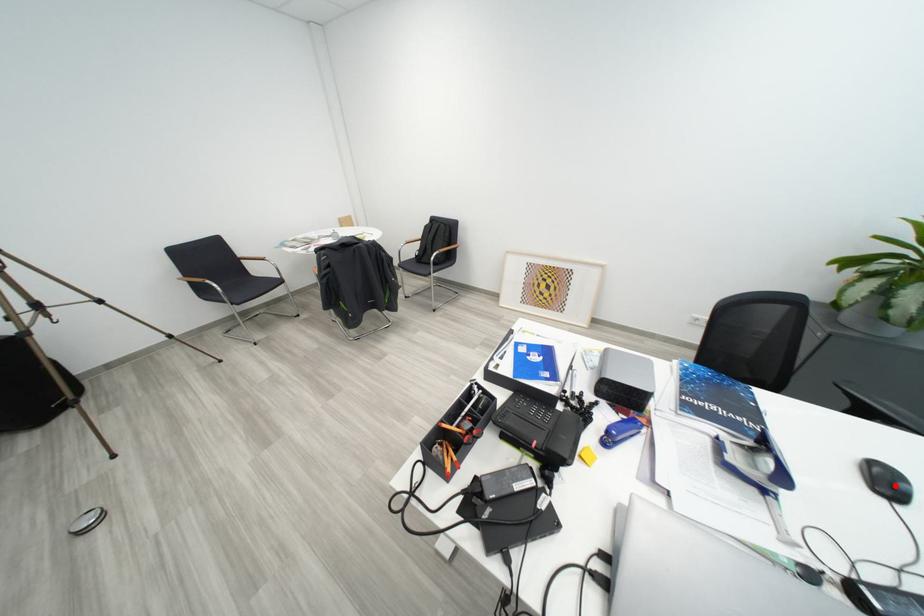
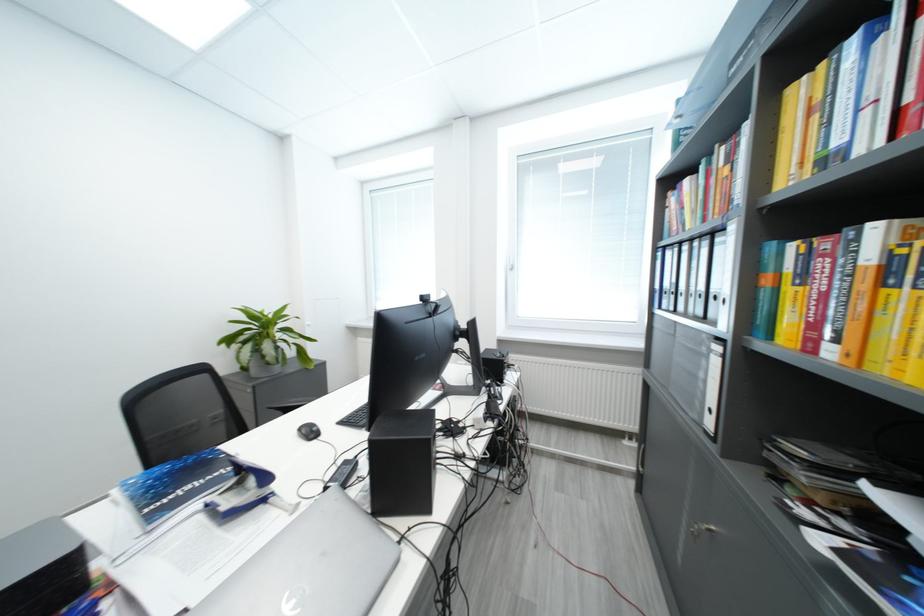
Where in the second image is the point corresponding to the highlighted location from the first image?

(319, 435)